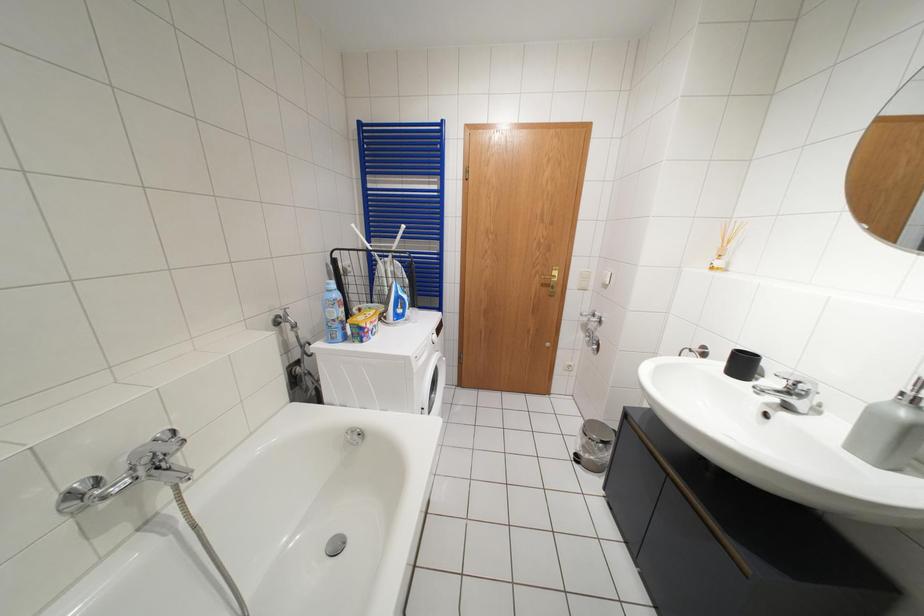
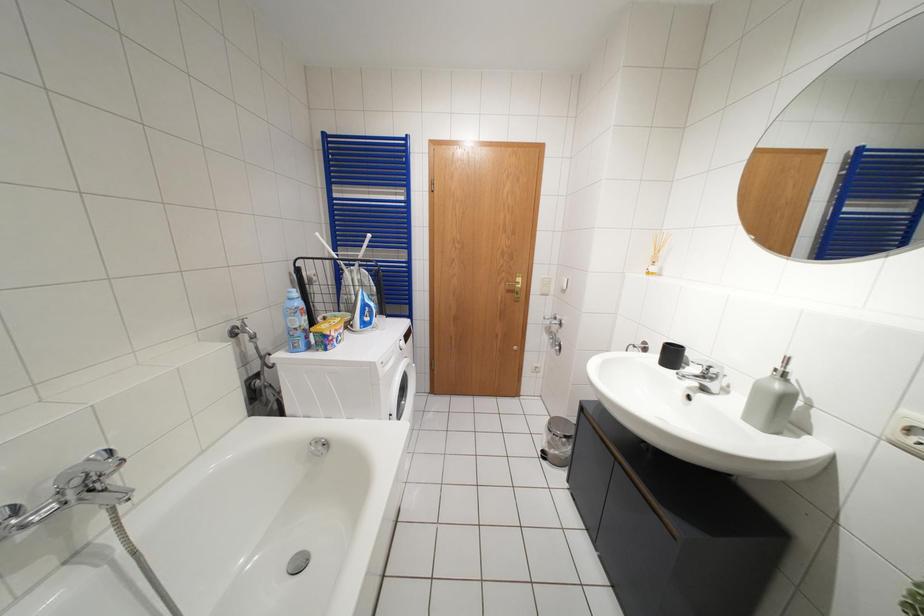
What movement of the cameraman would produce the second image?

The cameraman moved toward right, backward.